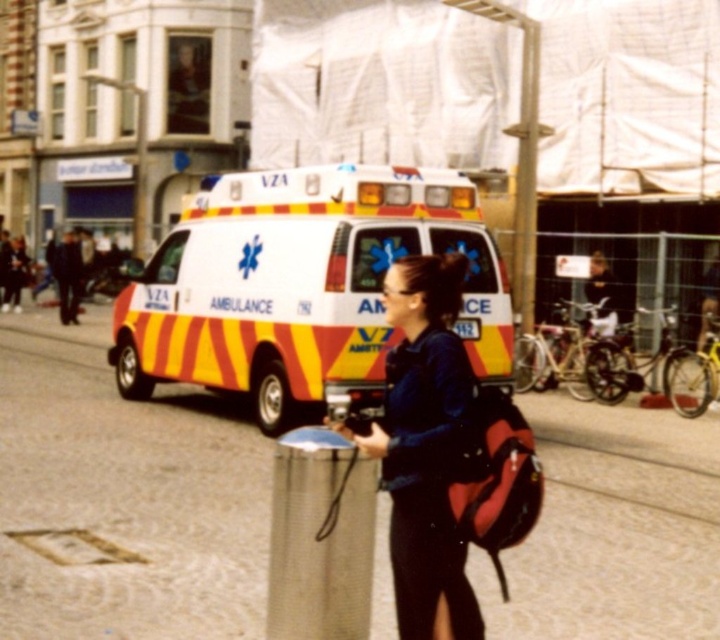
Consider the image. Can you confirm if concrete pavement at center is shorter than matte blue shirt at center?

Yes.

Can you confirm if concrete pavement at center is wider than matte blue shirt at center?

Yes, concrete pavement at center is wider than matte blue shirt at center.

Does point (379, 500) lie behind point (408, 538)?

Yes.

Identify the location of concrete pavement at center. This screenshot has width=720, height=640. (125, 493).

What do you see at coordinates (301, 284) in the screenshot?
I see `yellow and white striped ambulance at center` at bounding box center [301, 284].

Locate an element on the screen. This screenshot has height=640, width=720. yellow and white striped ambulance at center is located at coordinates (301, 284).

Find the location of `yellow and white striped ambulance at center`. yellow and white striped ambulance at center is located at coordinates (301, 284).

In the scene shown: Is concrete pavement at center smaller than yellow and white striped ambulance at center?

Incorrect, concrete pavement at center is not smaller in size than yellow and white striped ambulance at center.

Looking at this image, does concrete pavement at center have a larger size compared to yellow and white striped ambulance at center?

Yes.

Does point (58, 326) come farther from viewer compared to point (297, 332)?

Yes, point (58, 326) is behind point (297, 332).

I want to click on concrete pavement at center, so click(x=125, y=493).